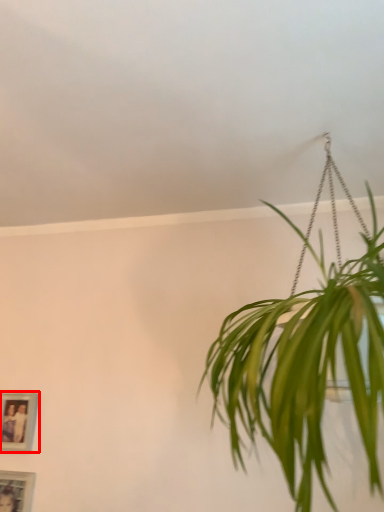
Question: From the image's perspective, where is picture frame (annotated by the red box) located relative to picture frame?

Choices:
 (A) above
 (B) below

Answer: (A)